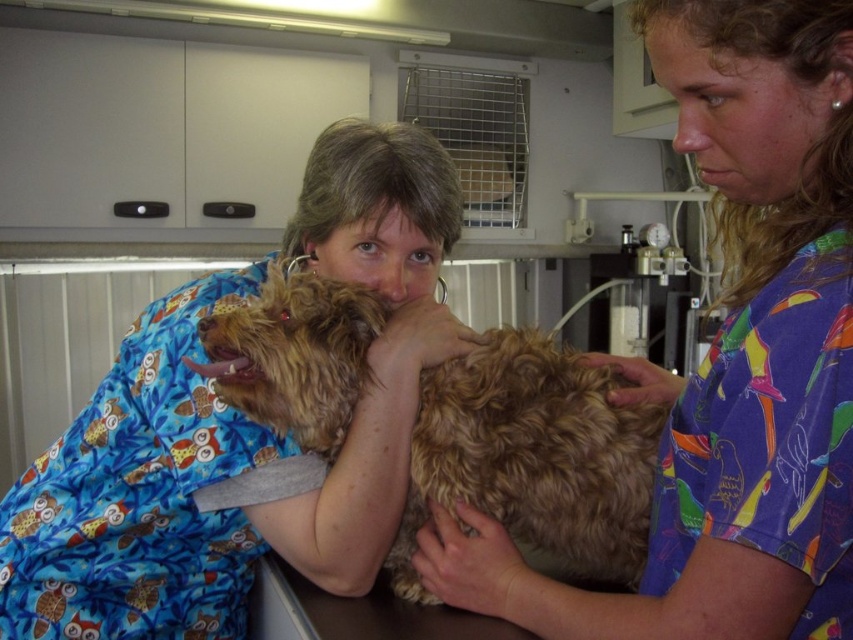
Does blue printed scrubs at center have a larger size compared to fuzzy brown dog at center?

Indeed, blue printed scrubs at center has a larger size compared to fuzzy brown dog at center.

Which of these two, blue printed scrubs at center or fuzzy brown dog at center, stands shorter?

fuzzy brown dog at center

Who is more forward, (128, 611) or (463, 371)?

Positioned in front is point (463, 371).

I want to click on blue printed scrubs at center, so click(x=238, y=429).